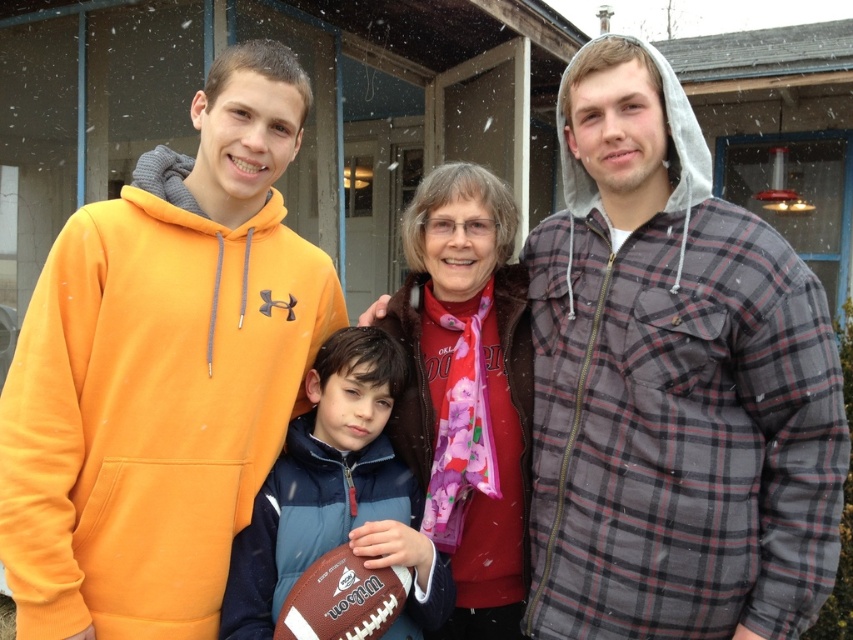
Is point (653, 422) positioned behind point (347, 609)?

Yes, point (653, 422) is behind point (347, 609).

Does plaid flannel shirt at right appear on the left side of white leather football at center?

No, plaid flannel shirt at right is not to the left of white leather football at center.

Who is more distant from viewer, (x=786, y=396) or (x=335, y=584)?

The point (x=335, y=584) is behind.

The image size is (853, 640). What are the coordinates of `plaid flannel shirt at right` in the screenshot? It's located at (672, 385).

Consider the image. Is blue fleece jacket at center wider than floral scarf at center?

Yes.

Is point (379, 467) closer to viewer compared to point (473, 204)?

Yes, point (379, 467) is in front of point (473, 204).

Image resolution: width=853 pixels, height=640 pixels. I want to click on blue fleece jacket at center, so point(338,515).

Who is positioned more to the left, plaid flannel shirt at right or orange fleece hoodie at left?

From the viewer's perspective, orange fleece hoodie at left appears more on the left side.

Which of these two, plaid flannel shirt at right or orange fleece hoodie at left, stands shorter?

Standing shorter between the two is orange fleece hoodie at left.

Between point (762, 248) and point (178, 177), which one is positioned behind?

The point (178, 177) is more distant.

This screenshot has height=640, width=853. Find the location of `plaid flannel shirt at right`. plaid flannel shirt at right is located at coordinates (672, 385).